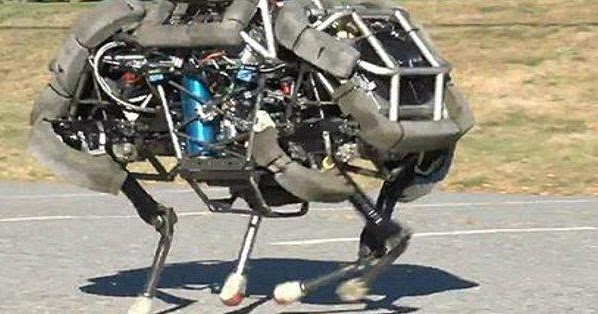
Find the location of a particular element. The image size is (598, 314). electric wires is located at coordinates (204, 57), (215, 64), (228, 58).